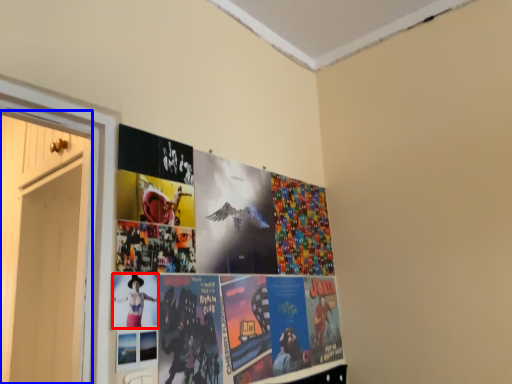
Question: Which object is closer to the camera taking this photo, person (highlighted by a red box) or door (highlighted by a blue box)?

Choices:
 (A) person
 (B) door

Answer: (A)